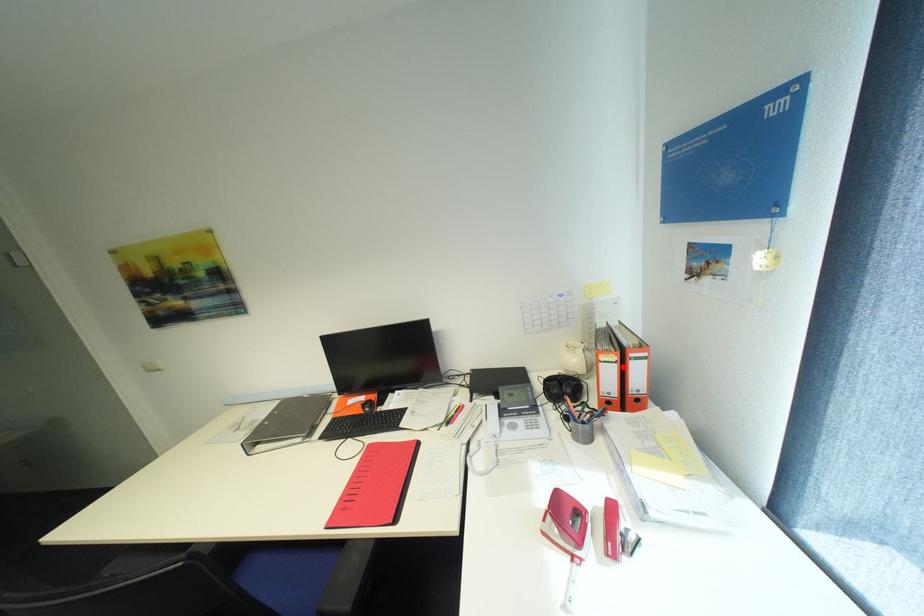
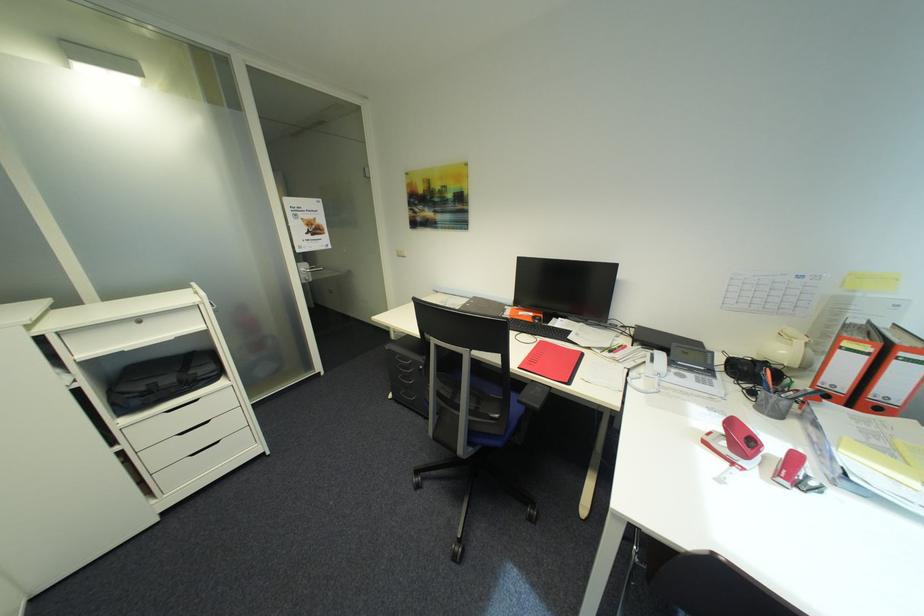
Question: A red point is marked in image1. In image2, is the corresponding 3D point closer to the camera or farther? Reply with the corresponding letter.

Choices:
 (A) The corresponding 3D point is closer.
 (B) The corresponding 3D point is farther.

Answer: (B)